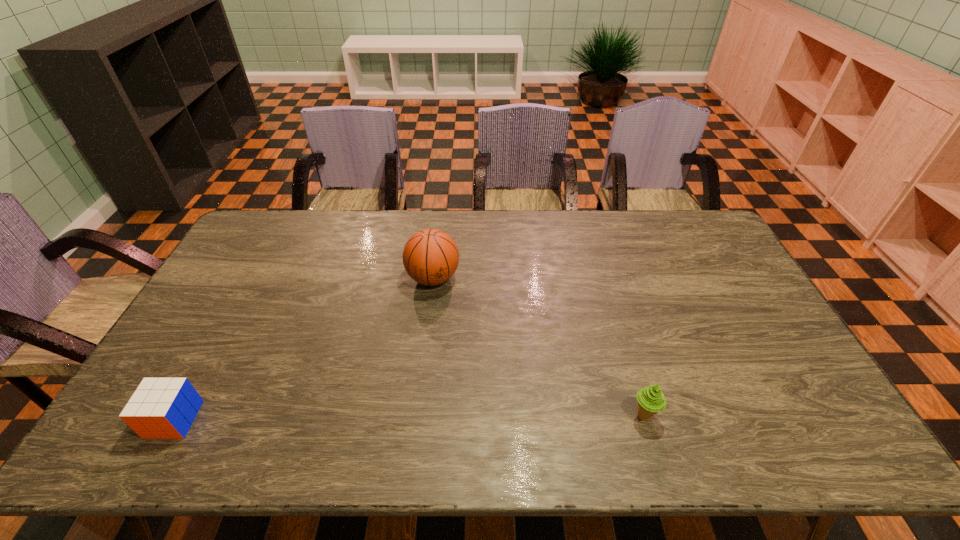
At what (x,y) coordinates should I click in order to perform the action: click on cube located in the near edge section of the desktop. Please return your answer as a coordinate pair (x, y). Image resolution: width=960 pixels, height=540 pixels. Looking at the image, I should click on (161, 408).

The width and height of the screenshot is (960, 540). Find the location of `object positioned at the left edge`. object positioned at the left edge is located at coordinates coord(161,408).

Identify the location of object present at the near left corner. The height and width of the screenshot is (540, 960). pos(161,408).

Image resolution: width=960 pixels, height=540 pixels. In order to click on free space at the far edge of the desktop in this screenshot , I will do `click(445, 228)`.

At what (x,y) coordinates should I click in order to perform the action: click on free location at the near edge. Please return your answer as a coordinate pair (x, y). Looking at the image, I should click on (775, 439).

This screenshot has height=540, width=960. What are the coordinates of `free space at the left edge` in the screenshot? It's located at (233, 325).

This screenshot has height=540, width=960. I want to click on vacant space at the right edge of the desktop, so click(802, 390).

In the image, there is a desktop. Where is `vacant space at the far left corner`? vacant space at the far left corner is located at coordinates (267, 247).

Locate an element on the screen. The height and width of the screenshot is (540, 960). free space between the second shortest object and the second object from right to left is located at coordinates (539, 347).

At what (x,y) coordinates should I click in order to perform the action: click on empty space that is in between the shortest object and the second object from right to left. Please return your answer as a coordinate pair (x, y). Image resolution: width=960 pixels, height=540 pixels. Looking at the image, I should click on point(303,349).